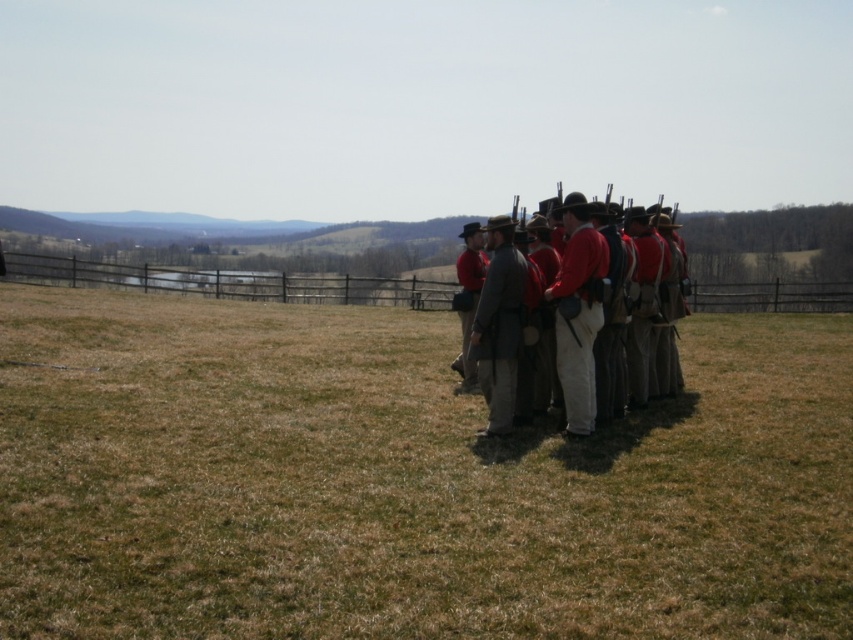
You are a photographer standing at the edge of the field. You want to take a photo that includes both the brown dry grass at center and the red woolen coat at center. What is the minimum distance you need to move forward to ensure both objects are in frame?

The minimum distance you need to move forward is 2.52 meters to ensure both the brown dry grass at center and the red woolen coat at center are in frame since they are 2.52 meters apart.

You are a photographer trying to capture a group photo of the red woolen coat at center and the gray wool coat at center. Since you want to ensure both coats are fully visible in the frame, which coat should you focus on first to avoid cropping the top of the image?

The red woolen coat at center is much taller than the gray wool coat at center, so you should focus on framing the red woolen coat at center first to ensure its full height is captured without being cut off.

You are a photographer planning to capture a group photo of the historical reenactment participants. You notice the brown dry grass at center and the gray wool coat at center in your frame. Which object takes up more horizontal space in the image?

The brown dry grass at center takes up more horizontal space in the image because its width is larger than that of the gray wool coat at center.